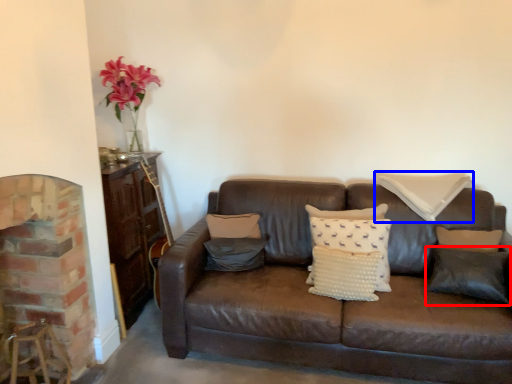
Question: Which object appears farthest to the camera in this image, pillow (highlighted by a red box) or pillow (highlighted by a blue box)?

Choices:
 (A) pillow
 (B) pillow

Answer: (B)